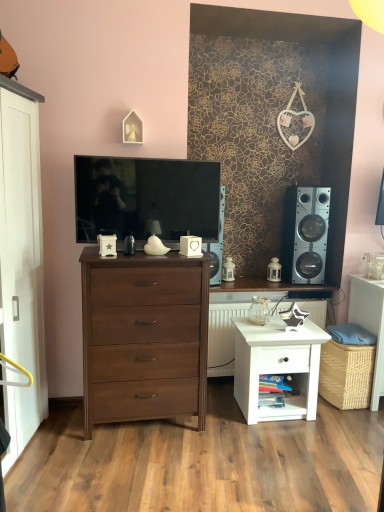
What do you see at coordinates (132, 128) in the screenshot? The height and width of the screenshot is (512, 384). I see `wooden angel at upper center` at bounding box center [132, 128].

At what (x,y) coordinates should I click in order to perform the action: click on white glossy radiator at center. Please return your answer as a coordinate pair (x, y). Looking at the image, I should click on (223, 336).

Locate an element on the screen. silver metallic speaker at right is located at coordinates (310, 234).

The height and width of the screenshot is (512, 384). Describe the element at coordinates (146, 198) in the screenshot. I see `matte black tv at center` at that location.

What do you see at coordinates (144, 337) in the screenshot?
I see `dark wood chest of drawers at center` at bounding box center [144, 337].

Find the location of a particular element. This screenshot has width=384, height=512. wooden angel at upper center is located at coordinates (132, 128).

Looking at their sizes, would you say white glossy radiator at center is wider or thinner than matte black tv at center?

Clearly, white glossy radiator at center has more width compared to matte black tv at center.

Is white glossy radiator at center further to the viewer compared to matte black tv at center?

Yes, it is behind matte black tv at center.

Is white glossy radiator at center oriented towards matte black tv at center?

No, white glossy radiator at center is not turned towards matte black tv at center.

From a real-world perspective, is white glossy radiator at center over matte black tv at center?

Actually, white glossy radiator at center is physically below matte black tv at center in the real world.

Is woven wicker basket at lower right directly adjacent to white glossy nightstand at lower right?

There is a gap between woven wicker basket at lower right and white glossy nightstand at lower right.

Between point (383, 318) and point (249, 377), which one is positioned in front?

Point (249, 377)

Does woven wicker basket at lower right come in front of white glossy nightstand at lower right?

No, it is behind white glossy nightstand at lower right.

Is woven wicker basket at lower right facing away from white glossy nightstand at lower right?

No, woven wicker basket at lower right is not facing away from white glossy nightstand at lower right.

From a real-world perspective, is woven wicker basket at lower right on top of silver metallic speaker at right?

Actually, woven wicker basket at lower right is physically below silver metallic speaker at right in the real world.

Are woven wicker basket at lower right and silver metallic speaker at right making contact?

They are not placed beside each other.

Does point (375, 407) lie behind point (303, 277)?

No, it is in front of (303, 277).

Is white glossy radiator at center taller than white glossy nightstand at lower right?

Yes.

Is white glossy radiator at center oriented away from white glossy nightstand at lower right?

No, white glossy radiator at center is not facing away from white glossy nightstand at lower right.

Is white glossy radiator at center thinner than white glossy nightstand at lower right?

Incorrect, the width of white glossy radiator at center is not less than that of white glossy nightstand at lower right.

Considering the relative sizes of white glossy radiator at center and white glossy nightstand at lower right in the image provided, is white glossy radiator at center smaller than white glossy nightstand at lower right?

No, white glossy radiator at center is not smaller than white glossy nightstand at lower right.

Based on the photo, is dark wood chest of drawers at center beside woven wicker basket at lower right?

dark wood chest of drawers at center and woven wicker basket at lower right are clearly separated.

Considering the sizes of objects dark wood chest of drawers at center and woven wicker basket at lower right in the image provided, who is thinner, dark wood chest of drawers at center or woven wicker basket at lower right?

With smaller width is dark wood chest of drawers at center.

Can you confirm if dark wood chest of drawers at center is bigger than woven wicker basket at lower right?

Yes.

How much distance is there between white glossy nightstand at lower right and matte black tv at center?

white glossy nightstand at lower right and matte black tv at center are 1.06 meters apart.

How different are the orientations of white glossy nightstand at lower right and matte black tv at center in degrees?

The facing directions of white glossy nightstand at lower right and matte black tv at center are 1.35 degrees apart.

Consider the image. Which is closer, (317, 360) or (172, 233)?

The point (172, 233) is closer.

Is white glossy nightstand at lower right touching matte black tv at center?

No, white glossy nightstand at lower right is not with matte black tv at center.

Considering the sizes of dark wood chest of drawers at center and white glossy radiator at center in the image, is dark wood chest of drawers at center wider or thinner than white glossy radiator at center?

dark wood chest of drawers at center is thinner than white glossy radiator at center.

Looking at this image, from the image's perspective, which is above, dark wood chest of drawers at center or white glossy radiator at center?

dark wood chest of drawers at center is shown above in the image.

Is dark wood chest of drawers at center not close to white glossy radiator at center?

No, dark wood chest of drawers at center is not far away from white glossy radiator at center.

From a real-world perspective, between dark wood chest of drawers at center and white glossy radiator at center, who is vertically higher?

In real-world perspective, dark wood chest of drawers at center is above.

Identify the location of radiator below the matte black tv at center (from a real-world perspective). (223, 336).

At what (x,y) coordinates should I click in order to perform the action: click on nightstand in front of the woven wicker basket at lower right. Please return your answer as a coordinate pair (x, y). Looking at the image, I should click on (277, 366).

Based on their spatial positions, is matte black tv at center or white glossy nightstand at lower right further from dark wood chest of drawers at center?

white glossy nightstand at lower right is positioned further to the anchor dark wood chest of drawers at center.

From the image, which object appears to be nearer to wooden angel at upper center, white glossy radiator at center or woven wicker basket at lower right?

white glossy radiator at center is positioned closer to the anchor wooden angel at upper center.

When comparing their distances from silver metallic speaker at right, does white glossy nightstand at lower right or matte black tv at center seem closer?

white glossy nightstand at lower right.

Based on their spatial positions, is white glossy radiator at center or dark wood chest of drawers at center further from white glossy nightstand at lower right?

Among the two, dark wood chest of drawers at center is located further to white glossy nightstand at lower right.

From the image, which object appears to be nearer to wooden angel at upper center, white glossy nightstand at lower right or silver metallic speaker at right?

silver metallic speaker at right.

Estimate the real-world distances between objects in this image. Which object is closer to white glossy radiator at center, silver metallic speaker at right or matte black tv at center?

silver metallic speaker at right is positioned closer to the anchor white glossy radiator at center.

When comparing their distances from white glossy nightstand at lower right, does matte black tv at center or woven wicker basket at lower right seem further?

The object further to white glossy nightstand at lower right is matte black tv at center.

From the image, which object appears to be farther from dark wood chest of drawers at center, white glossy radiator at center or silver metallic speaker at right?

The object further to dark wood chest of drawers at center is silver metallic speaker at right.

Locate an element on the screen. This screenshot has height=512, width=384. nightstand between white glossy radiator at center and woven wicker basket at lower right is located at coordinates (277, 366).

Find the location of a particular element. The width and height of the screenshot is (384, 512). the chest of drawers that lies between wooden angel at upper center and white glossy radiator at center from top to bottom is located at coordinates (x=144, y=337).

The height and width of the screenshot is (512, 384). What are the coordinates of `radiator situated between matte black tv at center and woven wicker basket at lower right from left to right` in the screenshot? It's located at (223, 336).

Image resolution: width=384 pixels, height=512 pixels. In order to click on the chest of drawers situated between wooden angel at upper center and woven wicker basket at lower right from left to right in this screenshot , I will do `click(144, 337)`.